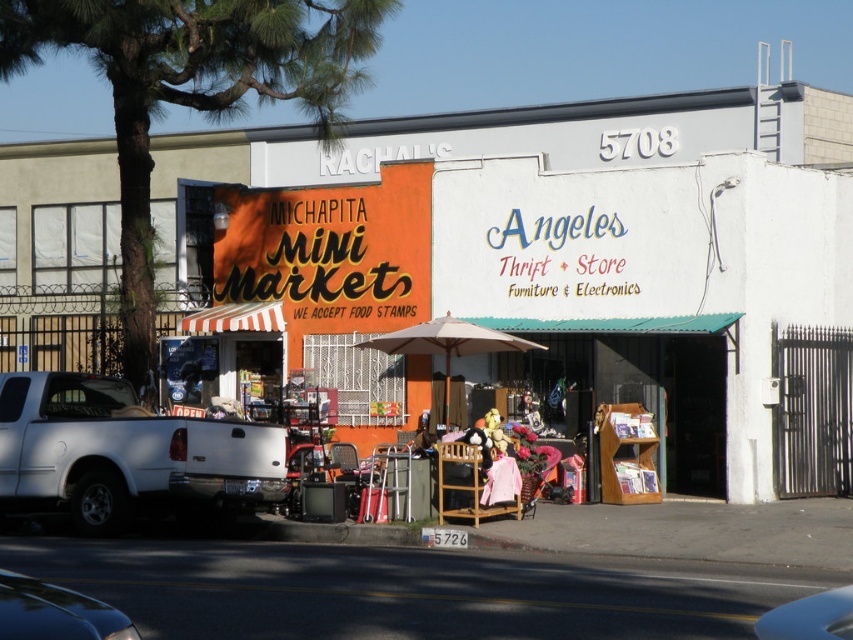
Question: Which of these objects is positioned farthest from the blue glossy car at lower right?

Choices:
 (A) white matte pickup truck at left
 (B) shiny black car at lower left

Answer: (A)

Question: Does shiny black car at lower left have a smaller size compared to blue glossy car at lower right?

Choices:
 (A) yes
 (B) no

Answer: (A)

Question: Which object appears closest to the camera in this image?

Choices:
 (A) shiny black car at lower left
 (B) white matte pickup truck at left

Answer: (A)

Question: Which object appears farthest from the camera in this image?

Choices:
 (A) shiny black car at lower left
 (B) white matte pickup truck at left

Answer: (B)

Question: Does white matte pickup truck at left appear on the right side of shiny black car at lower left?

Choices:
 (A) yes
 (B) no

Answer: (B)

Question: Does white matte pickup truck at left appear on the left side of shiny black car at lower left?

Choices:
 (A) no
 (B) yes

Answer: (B)